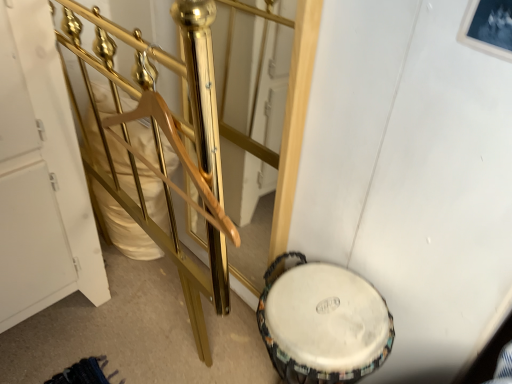
This screenshot has height=384, width=512. What do you see at coordinates (168, 140) in the screenshot?
I see `gold polished metal rail at center` at bounding box center [168, 140].

In order to face gold polished metal rail at center, should I rotate leftwards or rightwards?

Turn left by 14.478 degrees to look at gold polished metal rail at center.

Where is `gold polished metal rail at center`? The width and height of the screenshot is (512, 384). gold polished metal rail at center is located at coordinates (168, 140).

At what (x,y) coordinates should I click in order to perform the action: click on white fabric drum at lower right. Please return your answer as a coordinate pair (x, y). This screenshot has height=384, width=512. Looking at the image, I should click on (324, 325).

The width and height of the screenshot is (512, 384). Describe the element at coordinates (324, 325) in the screenshot. I see `white fabric drum at lower right` at that location.

In order to face white fabric drum at lower right, should I rotate leftwards or rightwards?

Turn right by 6.927 degrees to look at white fabric drum at lower right.

This screenshot has width=512, height=384. What are the coordinates of `gold polished metal rail at center` in the screenshot? It's located at (168, 140).

Looking at this image, would you say gold polished metal rail at center is to the left or to the right of white fabric drum at lower right in the picture?

From the image, it's evident that gold polished metal rail at center is to the left of white fabric drum at lower right.

Is gold polished metal rail at center positioned before white fabric drum at lower right?

Yes, gold polished metal rail at center is in front of white fabric drum at lower right.

Which is behind, point (147, 73) or point (306, 339)?

Point (306, 339)

From the image's perspective, which is below, gold polished metal rail at center or white fabric drum at lower right?

white fabric drum at lower right is shown below in the image.

From a real-world perspective, who is located higher, gold polished metal rail at center or white fabric drum at lower right?

gold polished metal rail at center.

Considering the relative sizes of gold polished metal rail at center and white fabric drum at lower right in the image provided, is gold polished metal rail at center wider than white fabric drum at lower right?

Incorrect, the width of gold polished metal rail at center does not surpass that of white fabric drum at lower right.

In terms of height, does gold polished metal rail at center look taller or shorter compared to white fabric drum at lower right?

Clearly, gold polished metal rail at center is shorter compared to white fabric drum at lower right.

In the scene shown: Considering the sizes of objects gold polished metal rail at center and white fabric drum at lower right in the image provided, who is bigger, gold polished metal rail at center or white fabric drum at lower right?

Bigger between the two is white fabric drum at lower right.

Would you say gold polished metal rail at center is inside or outside white fabric drum at lower right?

gold polished metal rail at center is spatially situated outside white fabric drum at lower right.

Are gold polished metal rail at center and white fabric drum at lower right located far from each other?

No, gold polished metal rail at center is not far from white fabric drum at lower right.

Consider the image. Is gold polished metal rail at center oriented towards white fabric drum at lower right?

No.

How many degrees apart are the facing directions of gold polished metal rail at center and white fabric drum at lower right?

0.817 degrees.

Identify the location of rail above the white fabric drum at lower right (from the image's perspective). (168, 140).

Is white fabric drum at lower right to the left of gold polished metal rail at center from the viewer's perspective?

No.

Looking at this image, considering the relative positions of white fabric drum at lower right and gold polished metal rail at center in the image provided, is white fabric drum at lower right behind gold polished metal rail at center?

Yes, it is behind gold polished metal rail at center.

Does point (263, 317) appear closer or farther from the camera than point (214, 302)?

Point (263, 317) appears to be closer to the viewer than point (214, 302).

From the image's perspective, who appears lower, white fabric drum at lower right or gold polished metal rail at center?

white fabric drum at lower right, from the image's perspective.

From a real-world perspective, is white fabric drum at lower right below gold polished metal rail at center?

Indeed, from a real-world perspective, white fabric drum at lower right is positioned beneath gold polished metal rail at center.

Considering the sizes of objects white fabric drum at lower right and gold polished metal rail at center in the image provided, who is wider, white fabric drum at lower right or gold polished metal rail at center?

white fabric drum at lower right.

Does white fabric drum at lower right have a greater height compared to gold polished metal rail at center?

Yes, white fabric drum at lower right is taller than gold polished metal rail at center.

Can you confirm if white fabric drum at lower right is bigger than gold polished metal rail at center?

Correct, white fabric drum at lower right is larger in size than gold polished metal rail at center.

Is white fabric drum at lower right inside the boundaries of gold polished metal rail at center, or outside?

white fabric drum at lower right is not enclosed by gold polished metal rail at center.

Is white fabric drum at lower right directly adjacent to gold polished metal rail at center?

white fabric drum at lower right and gold polished metal rail at center are clearly separated.

Is white fabric drum at lower right oriented towards gold polished metal rail at center?

No.

How different are the orientations of white fabric drum at lower right and gold polished metal rail at center in degrees?

0.817 degrees.

From the picture: Measure the distance between white fabric drum at lower right and gold polished metal rail at center.

The distance of white fabric drum at lower right from gold polished metal rail at center is 13.89 inches.

Locate an element on the screen. drum located below the gold polished metal rail at center (from the image's perspective) is located at coordinates (324, 325).

In order to click on rail that appears above the white fabric drum at lower right (from a real-world perspective) in this screenshot , I will do `click(168, 140)`.

The width and height of the screenshot is (512, 384). In order to click on rail that is in front of the white fabric drum at lower right in this screenshot , I will do `click(168, 140)`.